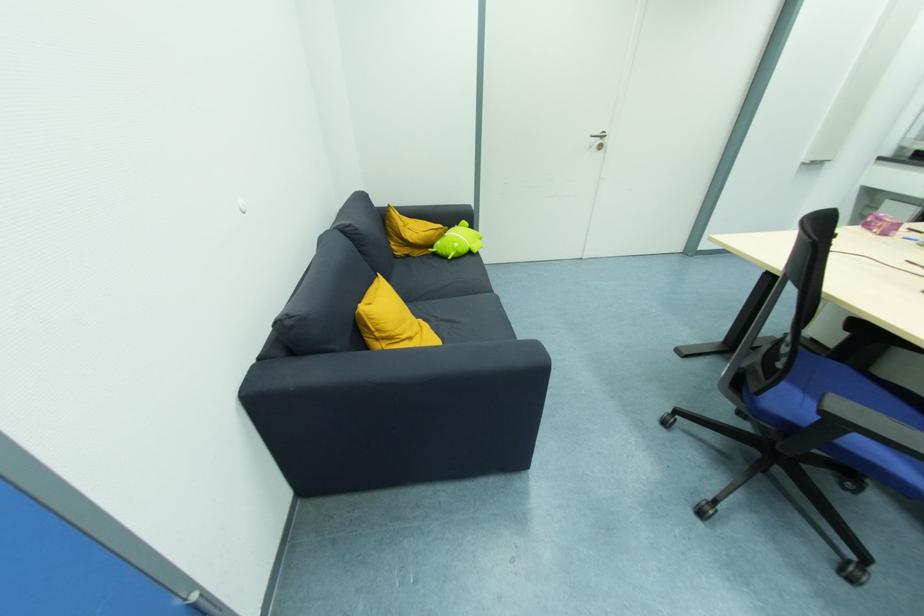
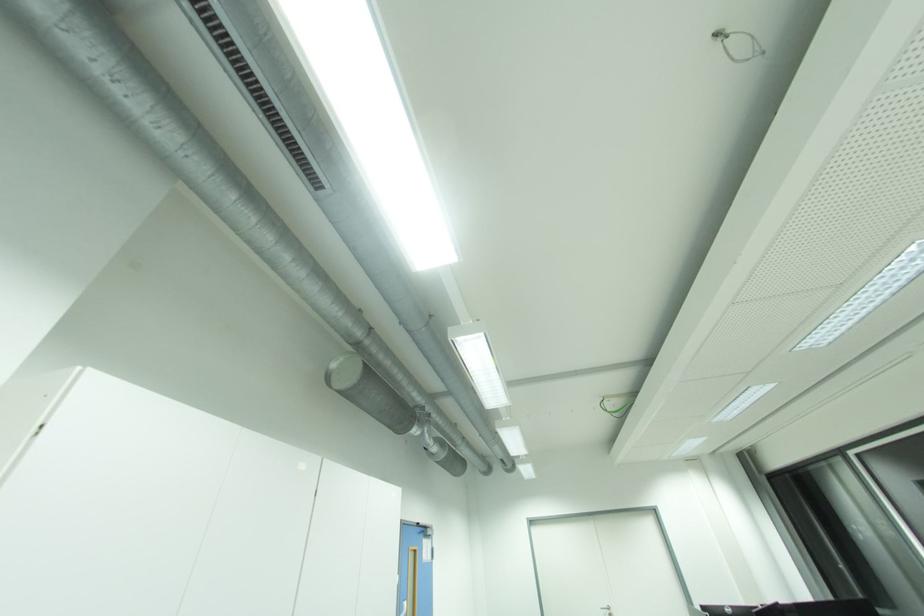
In the second image, find the point that corresponds to pixel 602 135 in the first image.

(610, 609)